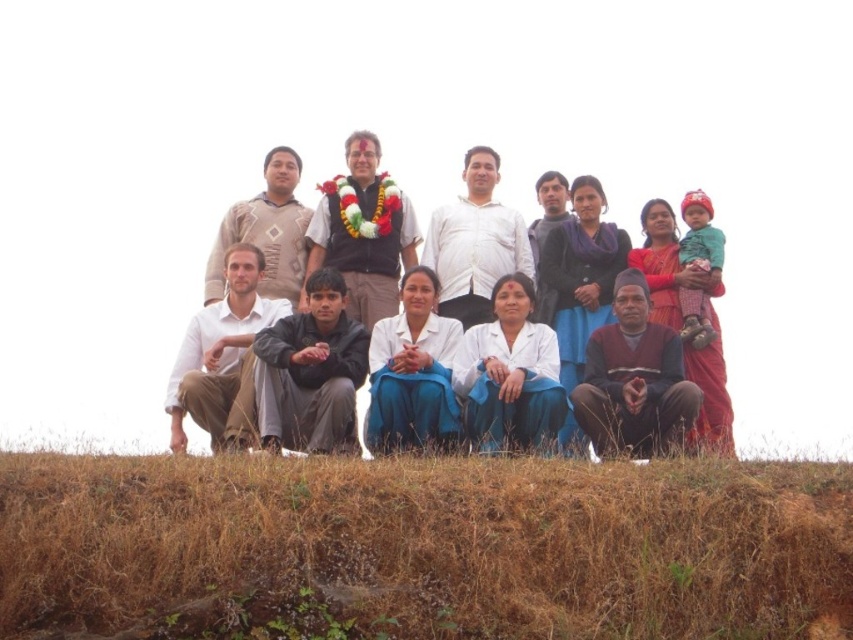
Consider the image. You are a photographer trying to capture a clear shot of the maroon sweater at lower center. However, the brown dry grass at lower center is blocking part of the view. Can you adjust your position to avoid the grass?

The brown dry grass at lower center is positioned under the maroon sweater at lower center, so moving your camera angle slightly upward might allow you to capture the maroon sweater without the grass obstruction.

Looking at the group of people on the grassy hillside, where is the white cotton shirt at center in relation to the knitted beige sweater at upper center?

The white cotton shirt at center is to the right of the knitted beige sweater at upper center.

You are a photographer standing at the edge of the grassy hillside. You want to take a photo of the maroon sweater at lower center without the brown dry grass at lower center blocking it. What should you do?

Move your position so that the maroon sweater at lower center is no longer behind the brown dry grass at lower center. Since the brown dry grass at lower center is in front of the maroon sweater at lower center, adjusting your angle or moving closer could help eliminate the obstruction.